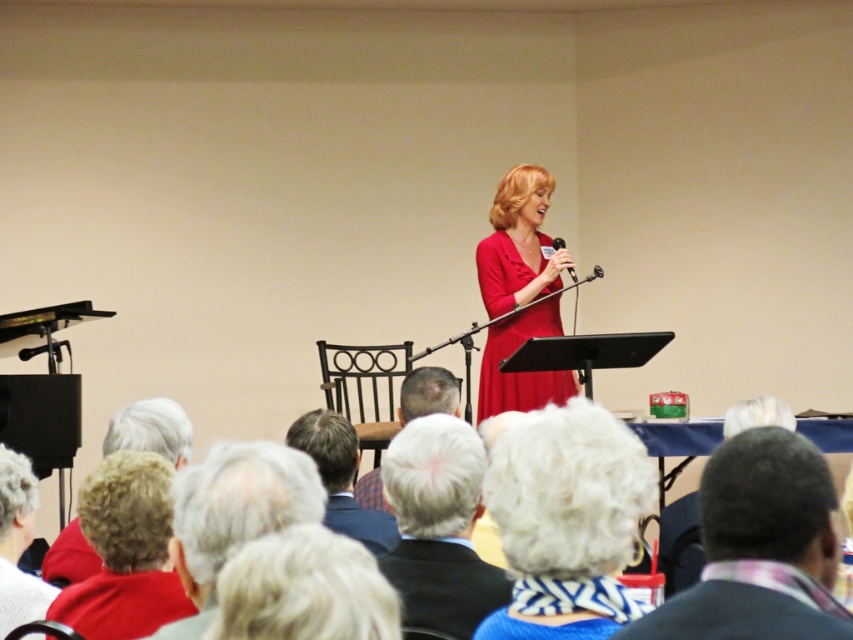
Does light brown wood chair at center appear on the right side of plaid fabric shirt at center?

No, light brown wood chair at center is not to the right of plaid fabric shirt at center.

Is light brown wood chair at center smaller than plaid fabric shirt at center?

Yes.

Find the location of a particular element. The width and height of the screenshot is (853, 640). light brown wood chair at center is located at coordinates pyautogui.click(x=341, y=477).

Where is `light brown wood chair at center`? The image size is (853, 640). light brown wood chair at center is located at coordinates (341, 477).

Between point (514, 435) and point (409, 419), which one is positioned in front?

Point (514, 435) is in front.

Does point (553, 621) lie behind point (450, 372)?

No, it is not.

Find the location of `white textured scarf at center`. white textured scarf at center is located at coordinates (566, 520).

Where is `white textured scarf at center`? Image resolution: width=853 pixels, height=640 pixels. white textured scarf at center is located at coordinates (566, 520).

Does white textured scarf at center appear on the left side of gray knit hat at lower left?

In fact, white textured scarf at center is to the right of gray knit hat at lower left.

Between white textured scarf at center and gray knit hat at lower left, which one is positioned higher?

white textured scarf at center

Is point (572, 540) farther from viewer compared to point (26, 513)?

No, (572, 540) is closer to viewer.

Locate an element on the screen. white textured scarf at center is located at coordinates (566, 520).